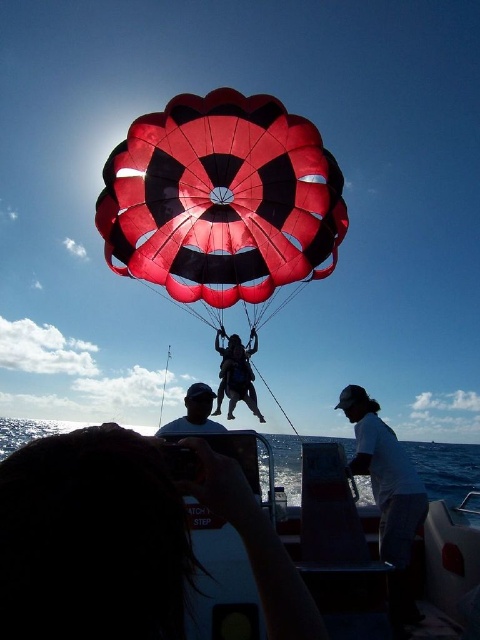
Which is behind, point (127, 275) or point (364, 480)?

Positioned behind is point (364, 480).

Can you confirm if red/black nylon parachute at center is wider than transparent blue water at lower center?

No.

Between point (316, 188) and point (451, 454), which one is positioned in front?

Point (316, 188)

The height and width of the screenshot is (640, 480). Identify the location of red/black nylon parachute at center. (222, 198).

Measure the distance between red/black nylon parachute at center and white cotton shirt at lower right.

The distance of red/black nylon parachute at center from white cotton shirt at lower right is 23.43 meters.

How far apart are red/black nylon parachute at center and white cotton shirt at lower right?

red/black nylon parachute at center and white cotton shirt at lower right are 23.43 meters apart.

Which is behind, point (266, 129) or point (363, 474)?

Point (266, 129)

The height and width of the screenshot is (640, 480). What are the coordinates of `red/black nylon parachute at center` in the screenshot? It's located at (222, 198).

Is white plastic boat at lower center further to camera compared to transparent blue water at lower center?

No, white plastic boat at lower center is in front of transparent blue water at lower center.

Is point (23, 458) closer to viewer compared to point (0, 432)?

Yes, point (23, 458) is closer to viewer.

This screenshot has width=480, height=640. Describe the element at coordinates (127, 540) in the screenshot. I see `white plastic boat at lower center` at that location.

I want to click on white plastic boat at lower center, so click(x=127, y=540).